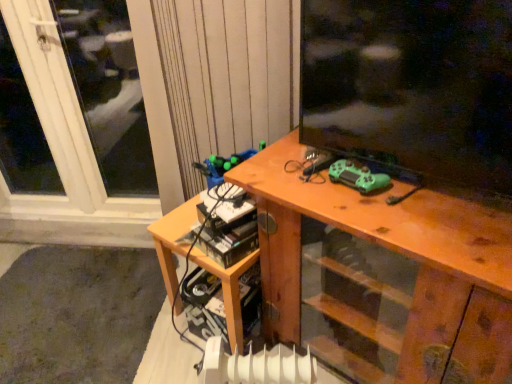
Locate an element on the screen. free space between matte black tv at upper right and green matte game controller at center is located at coordinates (415, 199).